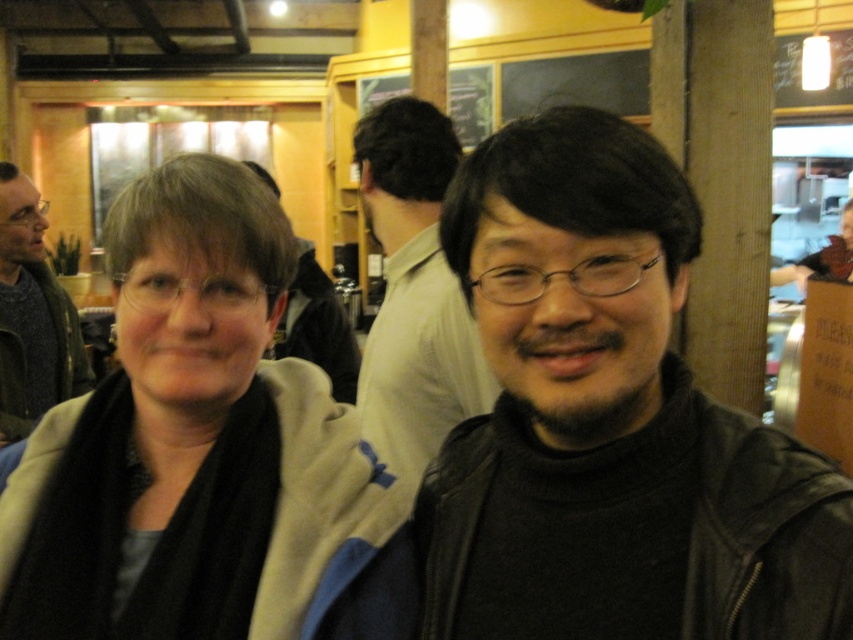
Question: Estimate the real-world distances between objects in this image. Which object is closer to the matte black jacket at center?

Choices:
 (A) beige fabric jacket at center
 (B) black matte jacket at center

Answer: (B)

Question: Is beige fabric jacket at center above matte black jacket at center?

Choices:
 (A) yes
 (B) no

Answer: (B)

Question: In this image, where is beige fabric jacket at center located relative to black matte jacket at center?

Choices:
 (A) above
 (B) below

Answer: (B)

Question: Is black matte jacket at center wider than matte black jacket at center?

Choices:
 (A) yes
 (B) no

Answer: (B)

Question: Which point appears closest to the camera in this image?

Choices:
 (A) (310, 296)
 (B) (415, 275)

Answer: (B)

Question: Which point is closer to the camera?

Choices:
 (A) black matte jacket at center
 (B) matte black jacket at center

Answer: (A)